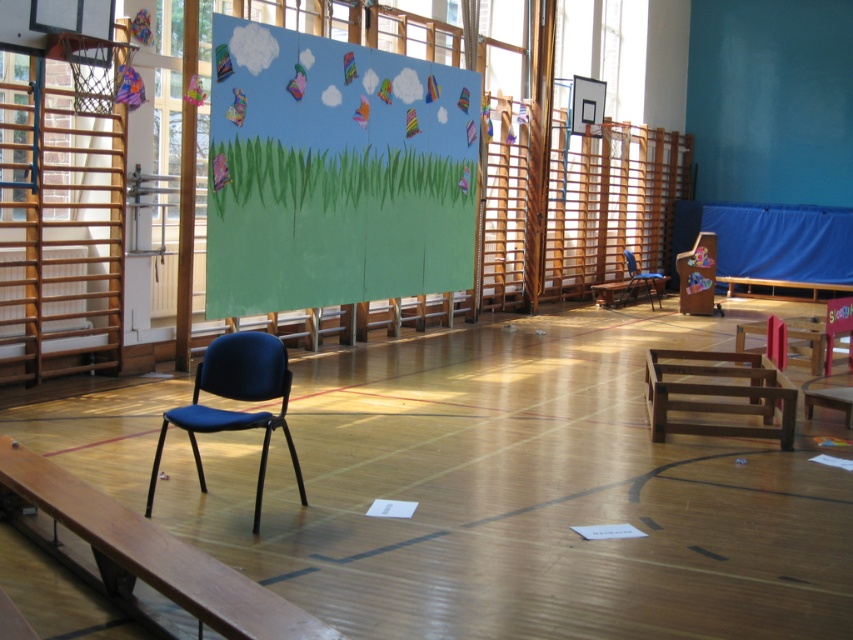
Question: Is wooden bench at lower left above brown wooden bench at center?

Choices:
 (A) yes
 (B) no

Answer: (B)

Question: Which point appears farthest from the camera in this image?

Choices:
 (A) (691, 362)
 (B) (201, 406)
 (C) (630, 276)

Answer: (C)

Question: Does pastel paper grass at center have a larger size compared to brown wooden bench at center?

Choices:
 (A) yes
 (B) no

Answer: (B)

Question: Which object is closer to the camera taking this photo?

Choices:
 (A) pastel paper grass at center
 (B) blue plastic chair at center

Answer: (A)

Question: Which of the following is the farthest from the observer?

Choices:
 (A) (225, 340)
 (B) (643, 275)
 (C) (30, 456)
 (D) (792, 296)

Answer: (D)

Question: Does wooden bench at lower left appear under blue fabric chair at left?

Choices:
 (A) yes
 (B) no

Answer: (A)